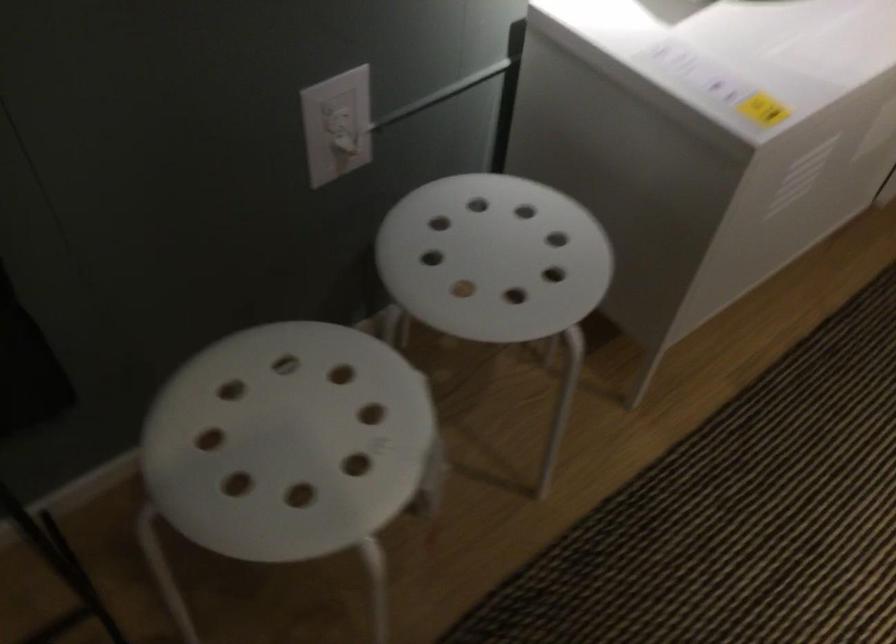
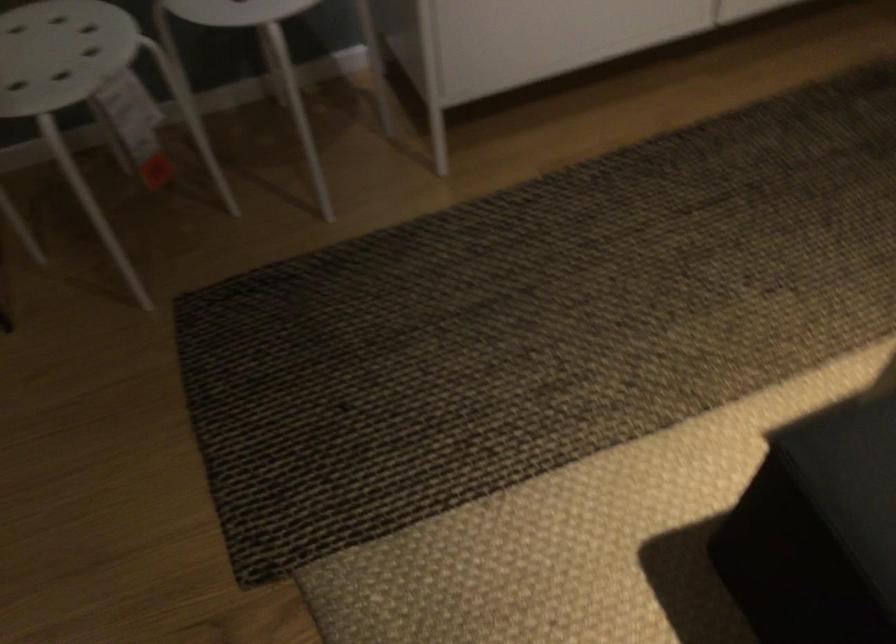
Question: Based on the continuous images, in which direction is the camera rotating? Reply with the corresponding letter.

Choices:
 (A) Left
 (B) Right
 (C) Up
 (D) Down

Answer: (A)